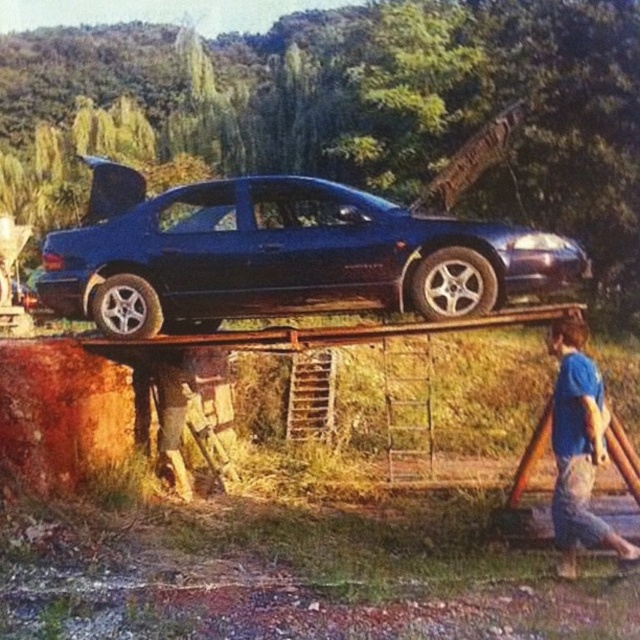
You are a delivery robot with a 1.2 meter long package. You need to place the package between the glossy blue sedan at center and the blue cotton shirt at lower right. Is there enough space to fit the package without moving either object?

The distance between the glossy blue sedan at center and the blue cotton shirt at lower right is 1.13 meters. Since the package is 1.2 meters long, it cannot fit in the available space without moving either object.

You are a delivery person who needs to park a new car that is exactly the same size as the glossy blue sedan at center in a parking spot that can only accommodate vehicles narrower than the blue cotton shirt at lower right. Will the new car fit in the parking spot?

The glossy blue sedan at center is wider than the blue cotton shirt at lower right. Since the parking spot can only accommodate vehicles narrower than the blue cotton shirt at lower right, the new car will not fit in the parking spot.